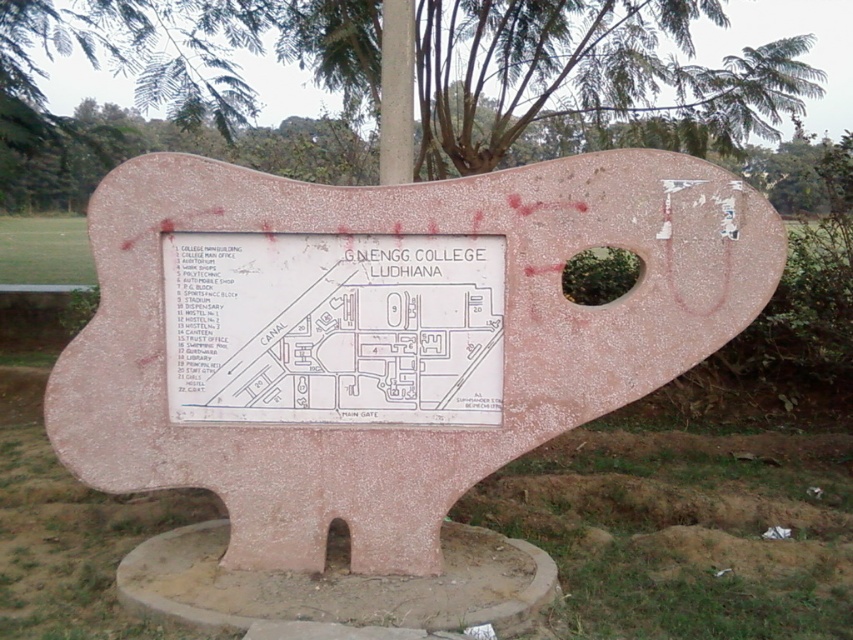
You are a visitor holding a 1.2 meter wide backpack and want to place it between the pink stone map at center and the metallic pole at upper center. Is there enough space?

The distance between the pink stone map at center and the metallic pole at upper center is 1.35 meters. Since your backpack is 1.2 meters wide, there is enough space to place it between them as the available space is slightly larger than the backpack.

You are standing at the entrance of G.N. ENGG COLLEGE LUDHIANA and see the stone signboard with two points marked on it. If you want to go to the point labeled point (585, 104), which is behind point (393, 83), do you need to walk around the signboard to reach it?

Yes, you need to walk around the signboard to reach point (585, 104) because it is located behind point (393, 83), which means it is not visible from your current position at the entrance.